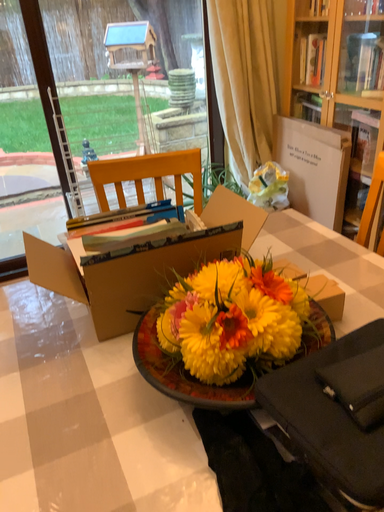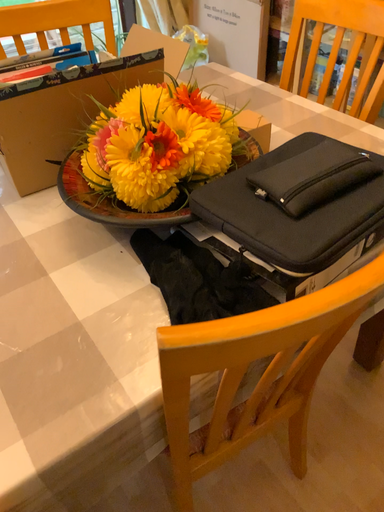
Question: Which way did the camera rotate in the video?

Choices:
 (A) rotated downward
 (B) rotated upward

Answer: (A)